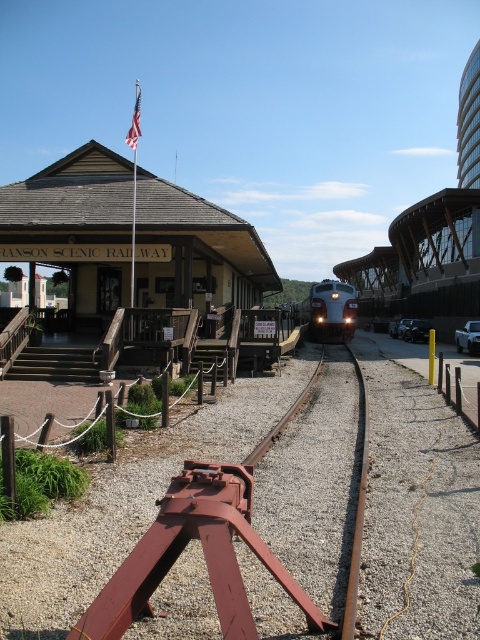
You are a photographer planning to take a wide shot of the brown wooden railway station at left and the metallic silver pickup truck at center. If you want to ensure both are fully visible in the frame, which object should you position closer to the edge of the frame to avoid cropping?

Since the brown wooden railway station at left is wider than the metallic silver pickup truck at center, you should position the brown wooden railway station at left closer to the edge of the frame to ensure both fit without cropping.

You are a photographer planning to take a photo of the brown wooden railway station at left and the rusty metal train track at center. Which object should you focus on first if you want to capture both in a single frame without moving the camera?

Since the brown wooden railway station at left is larger in size than the rusty metal train track at center, you should focus on the brown wooden railway station at left first to ensure it is sharp and centered in the frame before adjusting for the track.